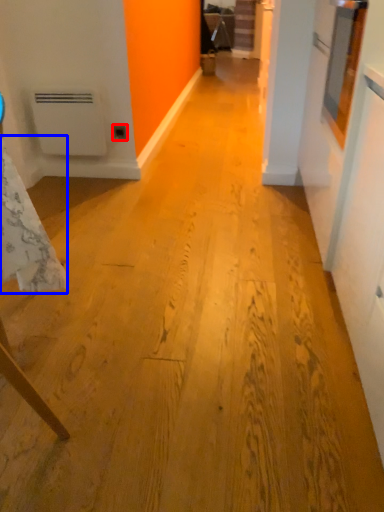
Question: Which of the following is the farthest to the observer, electric outlet (highlighted by a red box) or tablecloth (highlighted by a blue box)?

Choices:
 (A) electric outlet
 (B) tablecloth

Answer: (A)